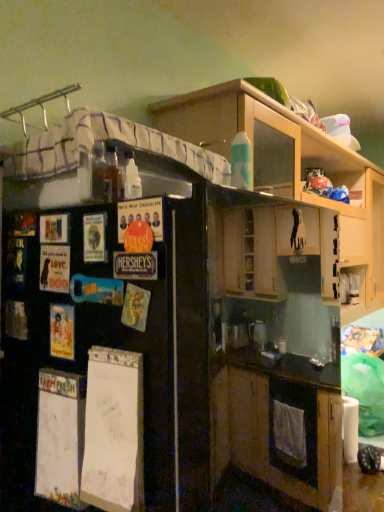
Question: Looking at the image, does matte paper poster at left, the 2th poster ordered from the bottom, seem bigger or smaller compared to wooden cabinets at upper center?

Choices:
 (A) small
 (B) big

Answer: (A)

Question: From their relative heights in the image, would you say matte paper poster at left, positioned as the 2th poster in top-to-bottom order, is taller or shorter than wooden cabinets at upper center?

Choices:
 (A) short
 (B) tall

Answer: (A)

Question: Based on their relative distances, which object is farther from the matte paper poster at left, placed as the 1th poster when sorted from back to front?

Choices:
 (A) black matte refrigerator at left
 (B) wooden cabinets at upper center
 (C) matte cardboard poster at left, arranged as the first poster when viewed from the right
 (D) matte paper poster at left, which ranks as the 2th poster in left-to-right order

Answer: (B)

Question: Based on their relative distances, which object is nearer to the wooden cabinets at upper center?

Choices:
 (A) matte cardboard poster at left, which appears as the 1th poster when viewed from the front
 (B) black matte refrigerator at left
 (C) matte paper poster at left, the 1th poster ordered from the bottom
 (D) matte paper poster at left, placed as the 1th poster when sorted from left to right

Answer: (B)